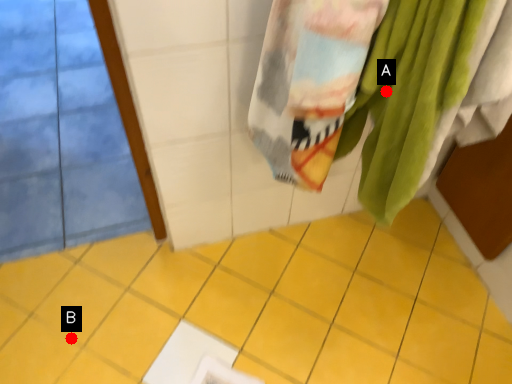
Question: Two points are circled on the image, labeled by A and B beside each circle. Which point appears farthest from the camera in this image?

Choices:
 (A) A is further
 (B) B is further

Answer: (B)